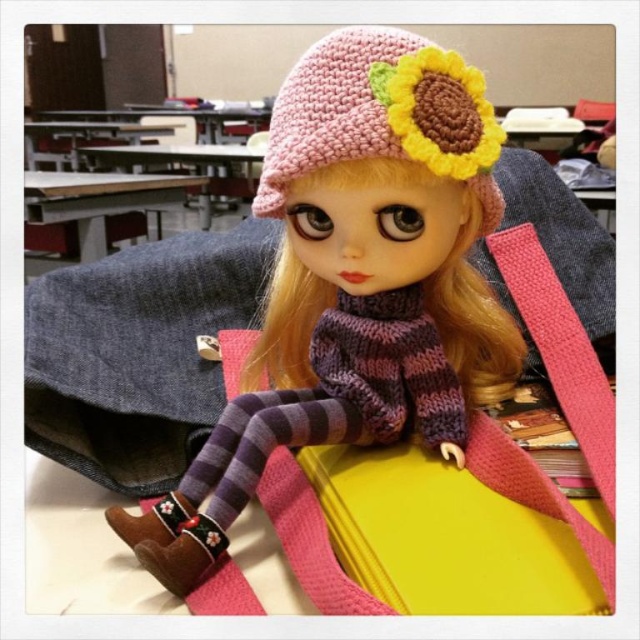
You are a student trying to reach the point at coordinates point at (468, 161) from your current position. If your backpack can only carry items up to 60 centimeters in length, can you stretch your arm to reach it without moving?

The distance between you and the point at (468, 161) is 61.26 centimeters, which exceeds the 60 centimeter limit of your backpack. Therefore, you cannot reach it without moving.

You are a student in the classroom looking at the doll. Which object is taller between the knitted pink hat at upper center and the pink knitted hat at upper center?

The knitted pink hat at upper center is much taller than the pink knitted hat at upper center according to the description.

You are a student in the classroom and want to put the knitted pink hat at upper center and the pink knitted hat at upper center into a small storage box. Which hat should you choose to fit better?

The pink knitted hat at upper center should be chosen because it is smaller in size compared to the knitted pink hat at upper center, making it more likely to fit into the small storage box.